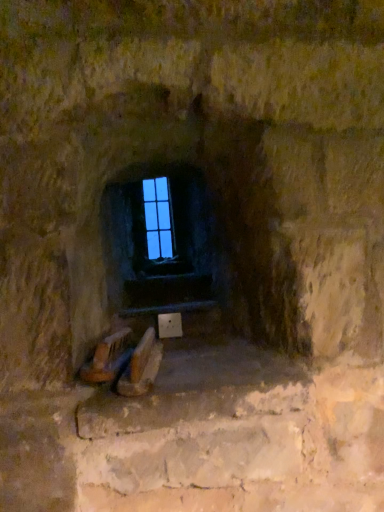
Question: Is transparent glass window at center facing towards smooth stone stairwell at center?

Choices:
 (A) no
 (B) yes

Answer: (A)

Question: Is transparent glass window at center closer to camera compared to smooth stone stairwell at center?

Choices:
 (A) no
 (B) yes

Answer: (A)

Question: Is transparent glass window at center bigger than smooth stone stairwell at center?

Choices:
 (A) no
 (B) yes

Answer: (A)

Question: From a real-world perspective, is transparent glass window at center beneath smooth stone stairwell at center?

Choices:
 (A) yes
 (B) no

Answer: (B)

Question: From the image's perspective, is transparent glass window at center on smooth stone stairwell at center?

Choices:
 (A) no
 (B) yes

Answer: (B)

Question: Would you say transparent glass window at center contains smooth stone stairwell at center?

Choices:
 (A) yes
 (B) no

Answer: (B)

Question: Is smooth stone stairwell at center facing away from transparent glass window at center?

Choices:
 (A) yes
 (B) no

Answer: (B)

Question: From a real-world perspective, is smooth stone stairwell at center on transparent glass window at center?

Choices:
 (A) yes
 (B) no

Answer: (B)

Question: Does smooth stone stairwell at center have a greater width compared to transparent glass window at center?

Choices:
 (A) no
 (B) yes

Answer: (B)

Question: Does smooth stone stairwell at center have a larger size compared to transparent glass window at center?

Choices:
 (A) no
 (B) yes

Answer: (B)

Question: Is smooth stone stairwell at center placed right next to transparent glass window at center?

Choices:
 (A) no
 (B) yes

Answer: (A)

Question: Is smooth stone stairwell at center in front of transparent glass window at center?

Choices:
 (A) no
 (B) yes

Answer: (B)

Question: Does point (163, 179) appear closer or farther from the camera than point (160, 290)?

Choices:
 (A) closer
 (B) farther

Answer: (B)